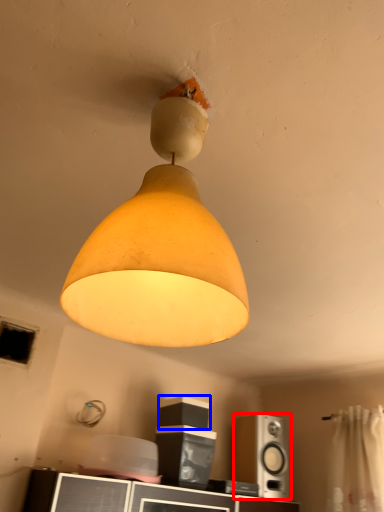
Question: Which object appears closest to the camera in this image, speaker (highlighted by a red box) or speaker (highlighted by a blue box)?

Choices:
 (A) speaker
 (B) speaker

Answer: (B)